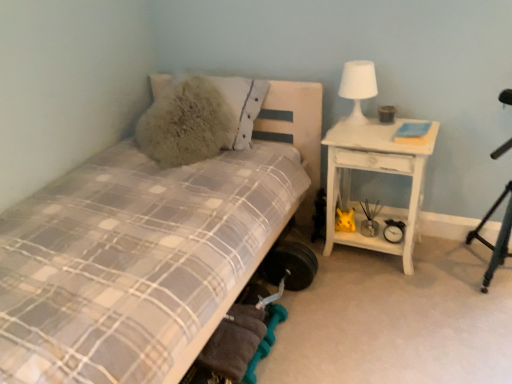
Find the location of a particular element. The image size is (512, 384). free space between white wood nightstand at right and teal metallic tripod at right is located at coordinates (442, 266).